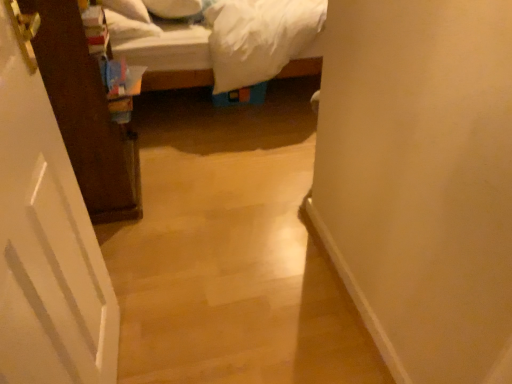
Question: Is white matte door at left bigger than white soft pillow at upper center, which appears as the first pillow when viewed from the right?

Choices:
 (A) yes
 (B) no

Answer: (A)

Question: From a real-world perspective, is white matte door at left positioned under white soft pillow at upper center, which appears as the first pillow when viewed from the right, based on gravity?

Choices:
 (A) yes
 (B) no

Answer: (A)

Question: Is white matte door at left wider than white soft pillow at upper center, positioned as the 2th pillow in left-to-right order?

Choices:
 (A) yes
 (B) no

Answer: (B)

Question: Does white matte door at left come in front of white soft pillow at upper center, which appears as the first pillow when viewed from the right?

Choices:
 (A) no
 (B) yes

Answer: (B)

Question: Would you say white soft pillow at upper center, which appears as the first pillow when viewed from the right, is part of white matte door at left's contents?

Choices:
 (A) yes
 (B) no

Answer: (B)

Question: Can you confirm if white matte door at left is positioned to the left of white soft pillow at upper center, which appears as the first pillow when viewed from the right?

Choices:
 (A) yes
 (B) no

Answer: (B)

Question: Is white soft pillow at upper left, which is the second pillow from right to left, positioned behind white matte door at left?

Choices:
 (A) yes
 (B) no

Answer: (A)

Question: Considering the relative positions of white soft pillow at upper left, the 1th pillow positioned from the left, and white matte door at left in the image provided, is white soft pillow at upper left, the 1th pillow positioned from the left, to the right of white matte door at left from the viewer's perspective?

Choices:
 (A) no
 (B) yes

Answer: (A)

Question: From the image's perspective, does white soft pillow at upper left, the 1th pillow positioned from the left, appear lower than white matte door at left?

Choices:
 (A) no
 (B) yes

Answer: (A)

Question: Considering the relative sizes of white soft pillow at upper left, the 1th pillow positioned from the left, and white matte door at left in the image provided, is white soft pillow at upper left, the 1th pillow positioned from the left, bigger than white matte door at left?

Choices:
 (A) yes
 (B) no

Answer: (B)

Question: Is white soft pillow at upper left, which is the second pillow from right to left, in contact with white matte door at left?

Choices:
 (A) yes
 (B) no

Answer: (B)

Question: Could white matte door at left be considered to be inside white soft pillow at upper left, which is the second pillow from right to left?

Choices:
 (A) yes
 (B) no

Answer: (B)

Question: Is white soft pillow at upper left, which is the second pillow from right to left, turned away from white soft pillow at upper center, positioned as the 2th pillow in left-to-right order?

Choices:
 (A) no
 (B) yes

Answer: (A)